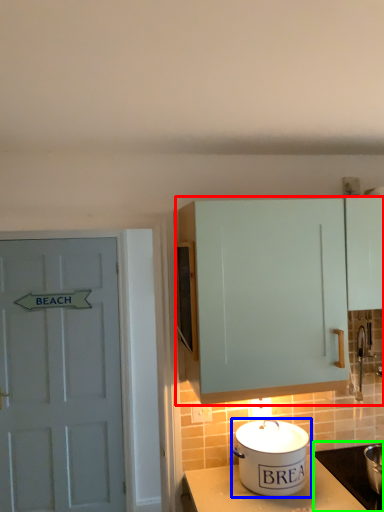
Question: Considering the real-world distances, which object is farthest from cabinetry (highlighted by a red box)? kitchen appliance (highlighted by a blue box) or appliance (highlighted by a green box)?

Choices:
 (A) kitchen appliance
 (B) appliance

Answer: (B)